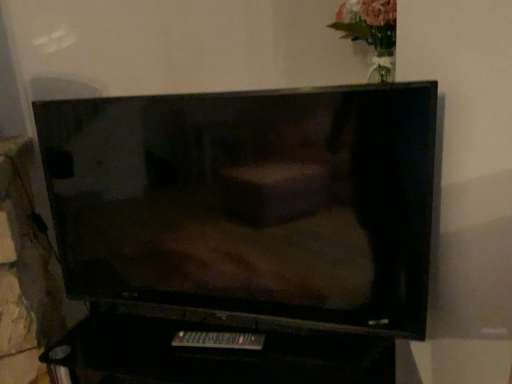
The image size is (512, 384). Find the location of `black plastic remote at lower center`. black plastic remote at lower center is located at coordinates (219, 340).

Describe the element at coordinates (219, 340) in the screenshot. I see `black plastic remote at lower center` at that location.

Describe the element at coordinates (249, 202) in the screenshot. The height and width of the screenshot is (384, 512). I see `matte black tv at center` at that location.

What is the approximate height of matte black tv at center?

The height of matte black tv at center is 22.28 inches.

Where is `matte black tv at center`? Image resolution: width=512 pixels, height=384 pixels. matte black tv at center is located at coordinates click(249, 202).

The height and width of the screenshot is (384, 512). I want to click on black plastic remote at lower center, so click(x=219, y=340).

Is matte black tv at center at the left side of black plastic remote at lower center?

Yes, matte black tv at center is to the left of black plastic remote at lower center.

Which object is further away from the camera, matte black tv at center or black plastic remote at lower center?

black plastic remote at lower center.

Does point (254, 121) lie behind point (217, 332)?

That is False.

From the image's perspective, between matte black tv at center and black plastic remote at lower center, which one is located above?

From the image's view, matte black tv at center is above.

From a real-world perspective, is matte black tv at center under black plastic remote at lower center?

No, from a real-world perspective, matte black tv at center is not below black plastic remote at lower center.

Considering the sizes of matte black tv at center and black plastic remote at lower center in the image, is matte black tv at center wider or thinner than black plastic remote at lower center?

Clearly, matte black tv at center has more width compared to black plastic remote at lower center.

Does matte black tv at center have a greater height compared to black plastic remote at lower center?

Yes.

Which of these two, matte black tv at center or black plastic remote at lower center, is smaller?

black plastic remote at lower center is smaller.

Is black plastic remote at lower center a part of matte black tv at center?

No, black plastic remote at lower center is not surrounded by matte black tv at center.

Does matte black tv at center touch black plastic remote at lower center?

There is a gap between matte black tv at center and black plastic remote at lower center.

Consider the image. Is matte black tv at center positioned with its back to black plastic remote at lower center?

No, matte black tv at center's orientation is not away from black plastic remote at lower center.

Can you tell me how much matte black tv at center and black plastic remote at lower center differ in facing direction?

8.43 degrees.

Where is `television on the left of black plastic remote at lower center`? The height and width of the screenshot is (384, 512). television on the left of black plastic remote at lower center is located at coordinates (249, 202).

Is black plastic remote at lower center to the right of matte black tv at center from the viewer's perspective?

Indeed, black plastic remote at lower center is positioned on the right side of matte black tv at center.

Which object is closer to the camera, black plastic remote at lower center or matte black tv at center?

matte black tv at center.

Which is closer to the camera, (186, 333) or (99, 156)?

Clearly, point (186, 333) is closer to the camera than point (99, 156).

From the image's perspective, which is above, black plastic remote at lower center or matte black tv at center?

matte black tv at center, from the image's perspective.

Looking at this image, from a real-world perspective, who is located lower, black plastic remote at lower center or matte black tv at center?

From a 3D spatial view, black plastic remote at lower center is below.

Between black plastic remote at lower center and matte black tv at center, which one has larger width?

matte black tv at center is wider.

Consider the image. Which of these two, black plastic remote at lower center or matte black tv at center, stands shorter?

black plastic remote at lower center is shorter.

Looking at the image, does black plastic remote at lower center seem bigger or smaller compared to matte black tv at center?

black plastic remote at lower center is smaller than matte black tv at center.

Would you say black plastic remote at lower center is inside or outside matte black tv at center?

black plastic remote at lower center lies outside matte black tv at center.

In the scene shown: Is black plastic remote at lower center not near matte black tv at center?

No, black plastic remote at lower center is in close proximity to matte black tv at center.

Could you tell me if black plastic remote at lower center is turned towards matte black tv at center?

No, black plastic remote at lower center is not aimed at matte black tv at center.

Find the location of a particular element. This screenshot has width=512, height=384. remote below the matte black tv at center (from the image's perspective) is located at coordinates (219, 340).

Locate an element on the screen. television located in front of the black plastic remote at lower center is located at coordinates click(249, 202).

This screenshot has width=512, height=384. What are the coordinates of `remote behind the matte black tv at center` in the screenshot? It's located at (219, 340).